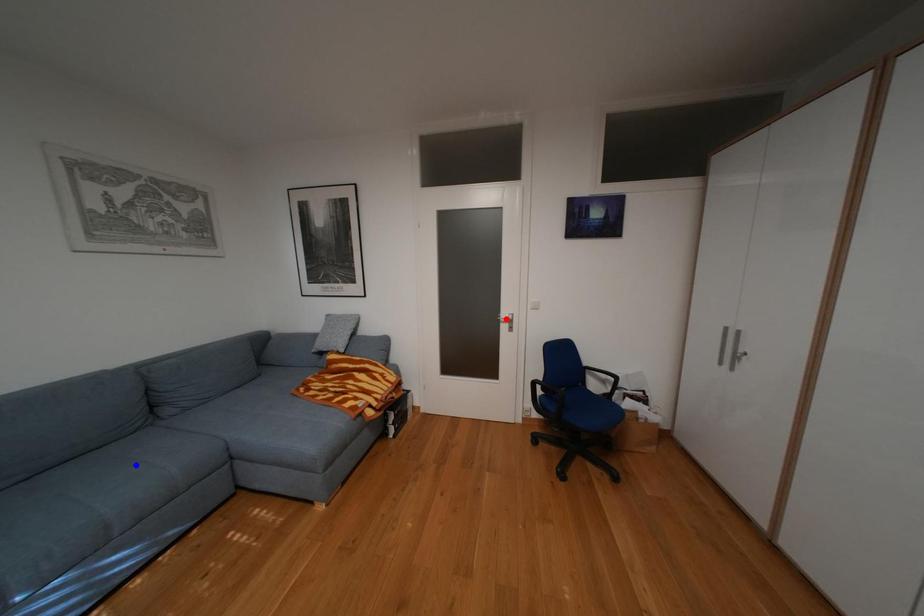
Question: Which of the two points in the image is closer to the camera?

Choices:
 (A) Blue point is closer.
 (B) Red point is closer.

Answer: (A)